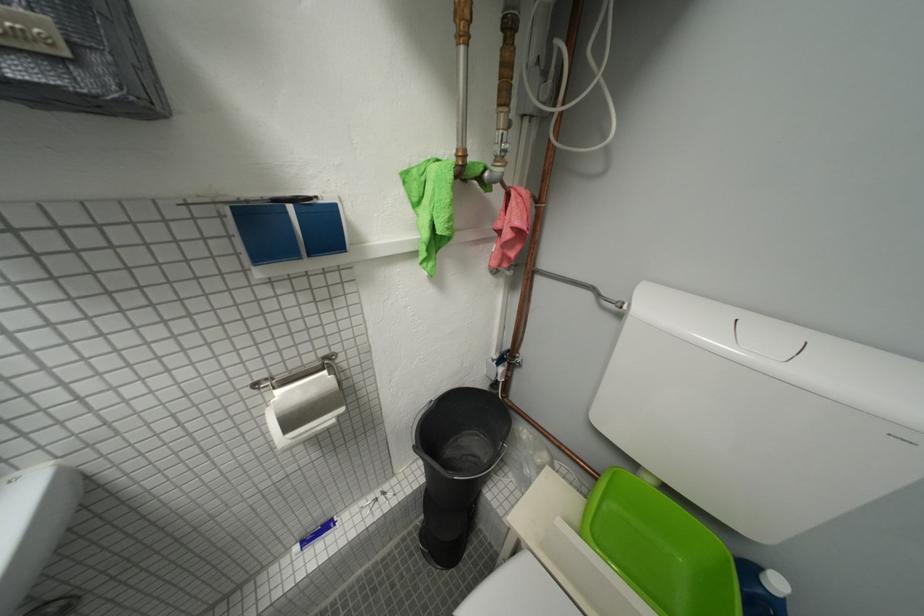
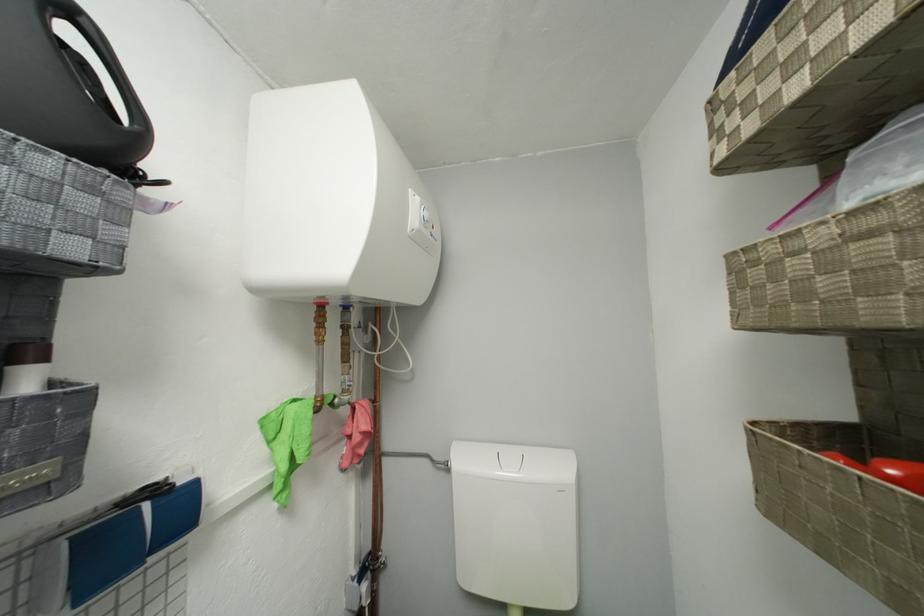
In the second image, find the point that corresponds to point 434,237 in the first image.

(293, 469)